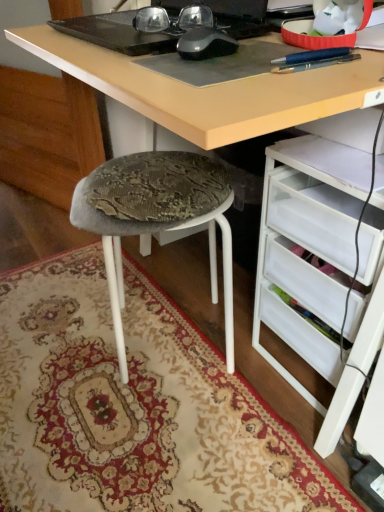
Identify the location of free spot above carpeted rug at lower left (from a real-world perspective). (109, 374).